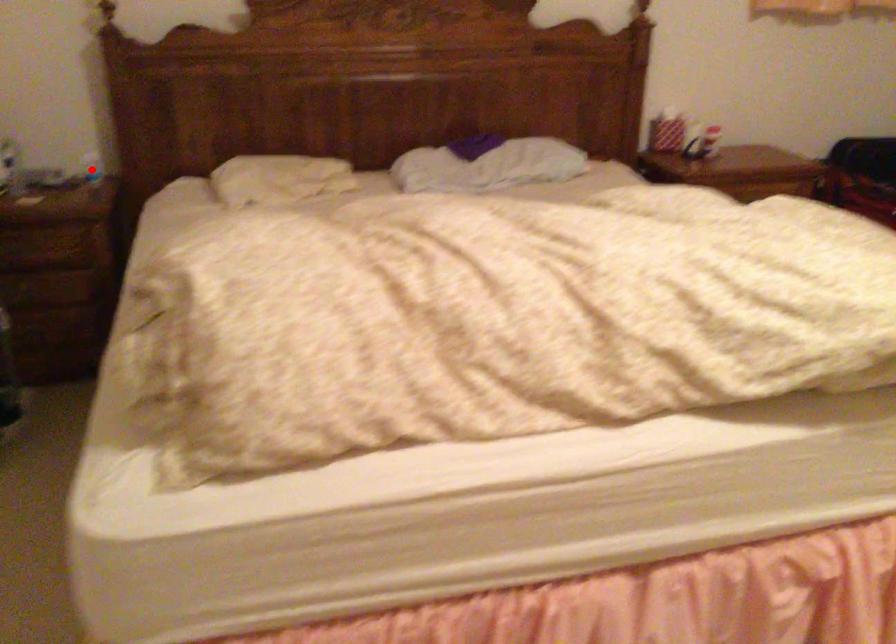
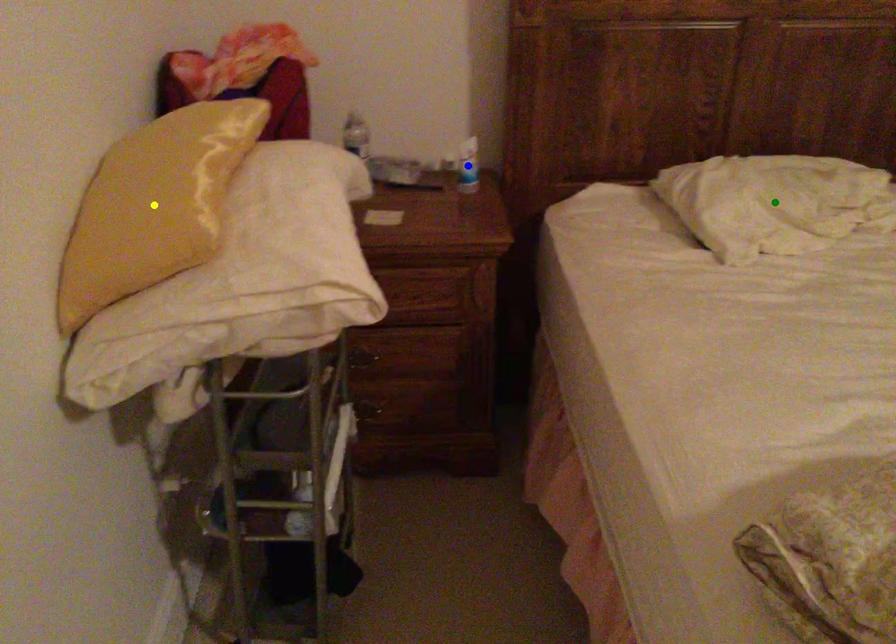
Question: I am providing you with two images of the same scene from different viewpoints. A red point is marked on the first image. You are given multiple points on the second image. Which mark in image 2 goes with the point in image 1?

Choices:
 (A) yellow point
 (B) blue point
 (C) green point

Answer: (B)